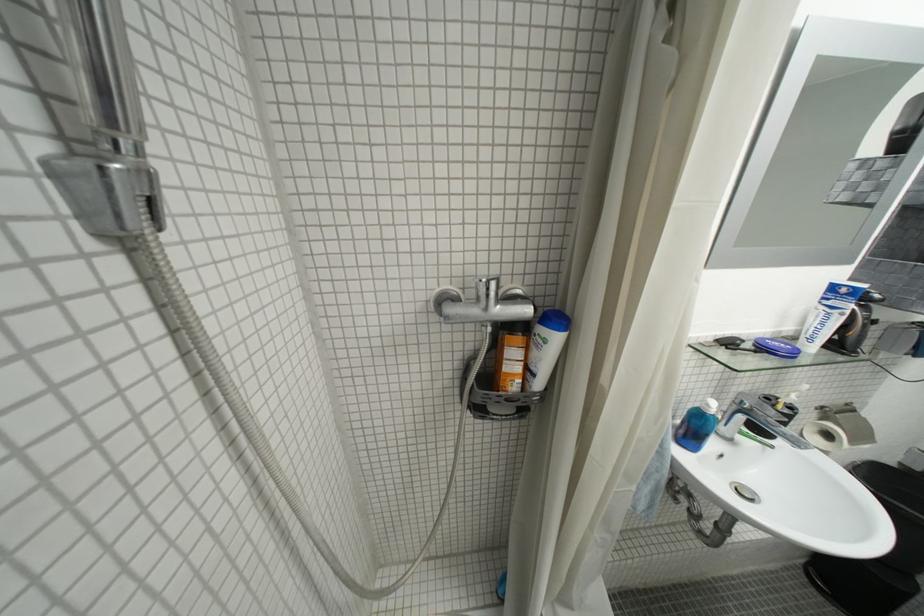
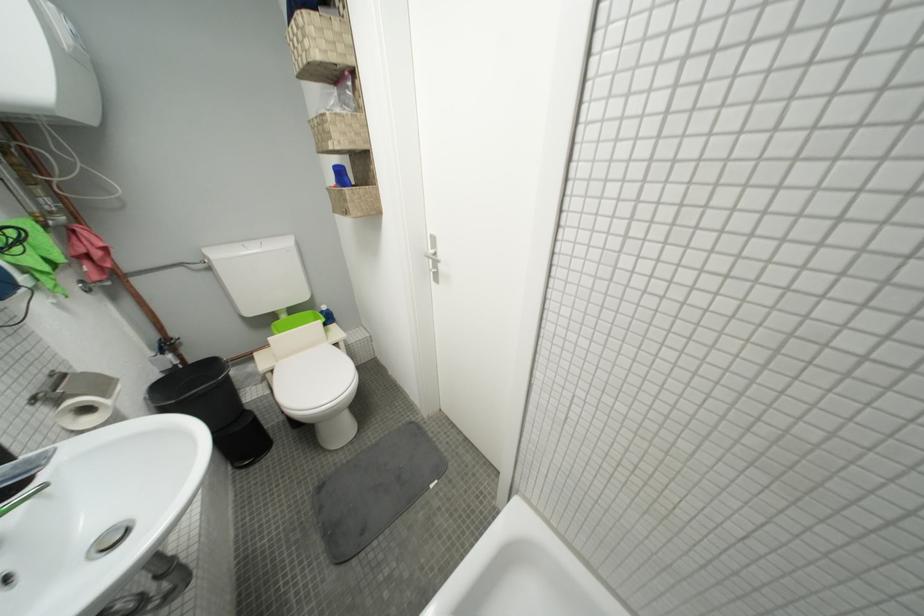
Locate, in the second image, the point that corresponds to the point at 861,444 in the first image.

(113, 397)